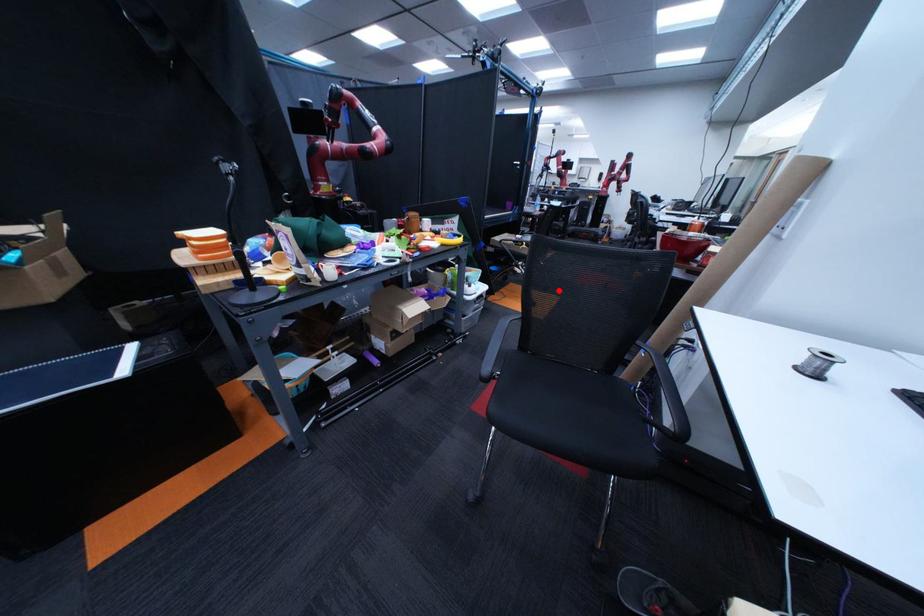
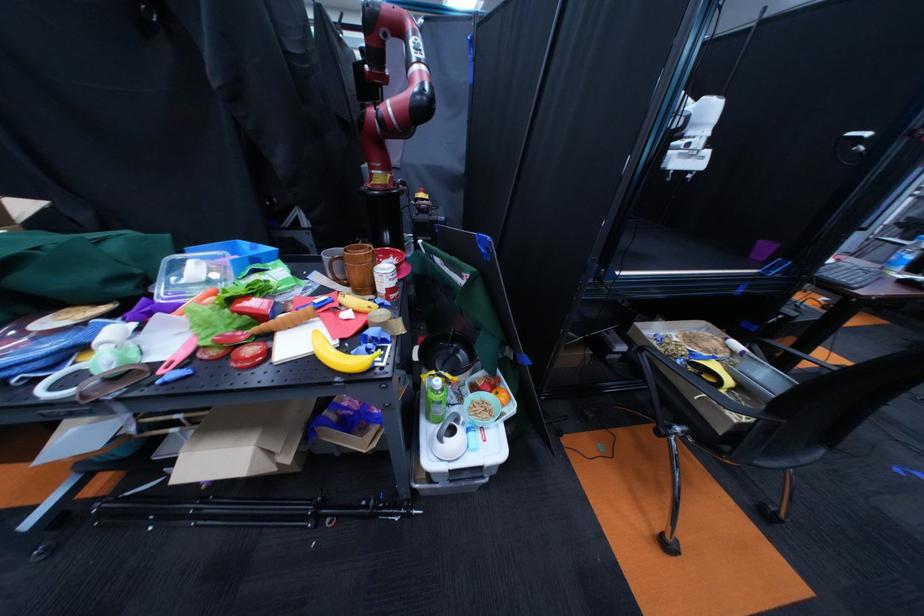
The point at the highlighted location is marked in the first image. Where is the corresponding point in the second image?

(776, 517)